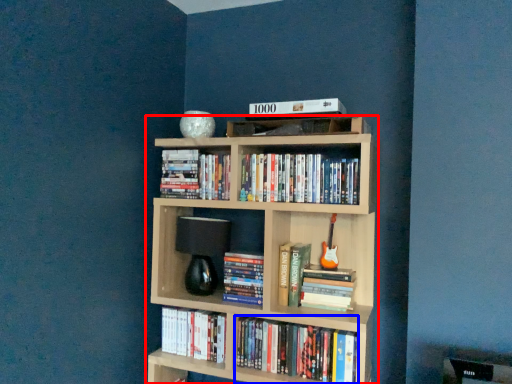
Question: Which object appears farthest to the camera in this image, bookcase (highlighted by a red box) or book (highlighted by a blue box)?

Choices:
 (A) bookcase
 (B) book

Answer: (B)